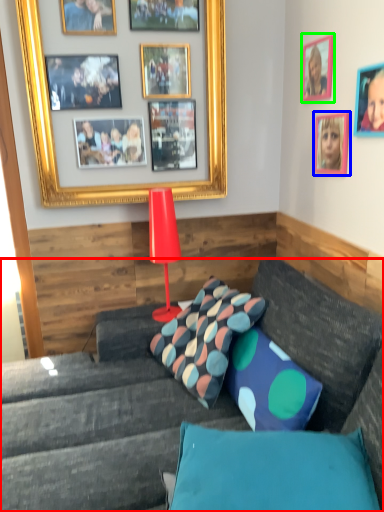
Question: Which is farther away from studio couch (highlighted by a red box)? picture frame (highlighted by a blue box) or picture frame (highlighted by a green box)?

Choices:
 (A) picture frame
 (B) picture frame

Answer: (B)